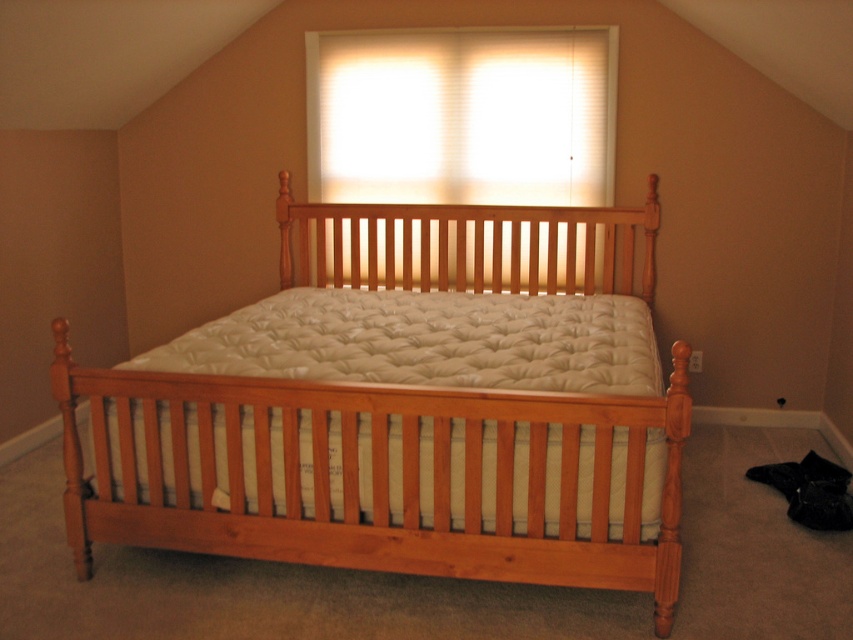
Measure the distance between natural wood bed at center and white quilted mattress at center.

natural wood bed at center and white quilted mattress at center are 6.62 centimeters apart from each other.

This screenshot has height=640, width=853. What do you see at coordinates (405, 406) in the screenshot? I see `natural wood bed at center` at bounding box center [405, 406].

You are a GUI agent. You are given a task and a screenshot of the screen. Output one action in this format:
    pyautogui.click(x=<x>, y=<y>)
    Task: Click on the natural wood bed at center
    This screenshot has width=853, height=640.
    Given the screenshot: What is the action you would take?
    pyautogui.click(x=405, y=406)

Between white quilted mattress at center and white blinds at upper center, which one is positioned higher?

white blinds at upper center is higher up.

Which is in front, point (242, 308) or point (480, 196)?

Positioned in front is point (242, 308).

Is point (264, 300) farther from viewer compared to point (614, 83)?

No, (264, 300) is closer to viewer.

Locate an element on the screen. white quilted mattress at center is located at coordinates (428, 342).

Is natural wood bed at center wider than white blinds at upper center?

Indeed, natural wood bed at center has a greater width compared to white blinds at upper center.

Is point (595, 552) more distant than point (573, 115)?

That is False.

Locate an element on the screen. This screenshot has height=640, width=853. natural wood bed at center is located at coordinates (405, 406).